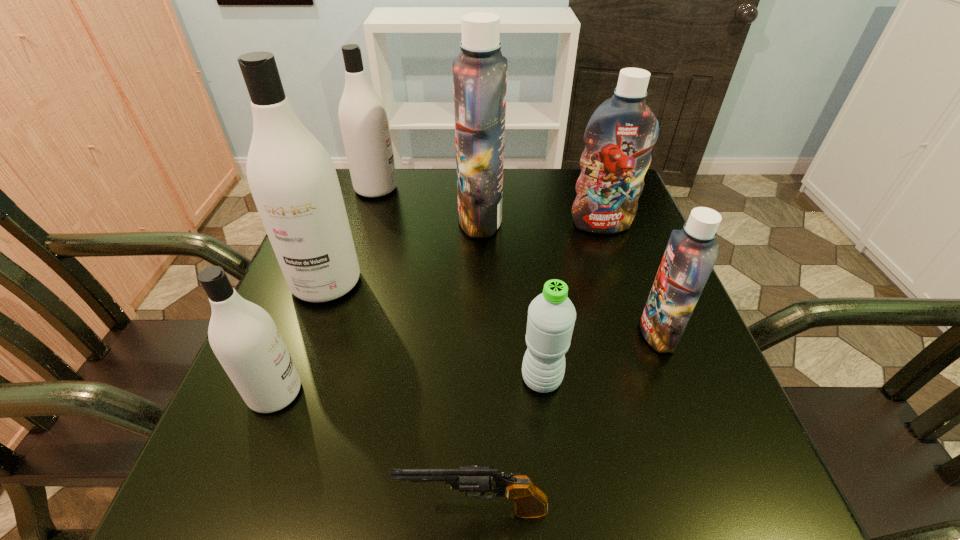
Select which shampoo appears as the fifth closest to the nearest white shampoo. Please provide its 2D coordinates. Your answer should be formatted as a tuple, i.e. [(x, y)], where the tuple contains the x and y coordinates of a point satisfying the conditions above.

[(619, 137)]

This screenshot has width=960, height=540. I want to click on blue shampoo object that ranks as the second closest to the biggest white shampoo, so click(x=619, y=137).

Locate which blue shampoo ranks third in proximity to the third nearest shampoo. Please provide its 2D coordinates. Your answer should be formatted as a tuple, i.e. [(x, y)], where the tuple contains the x and y coordinates of a point satisfying the conditions above.

[(691, 253)]

Identify which white shampoo is the second nearest to the nearest shampoo. Please provide its 2D coordinates. Your answer should be formatted as a tuple, i.e. [(x, y)], where the tuple contains the x and y coordinates of a point satisfying the conditions above.

[(363, 118)]

Identify which white shampoo is the second closest to the biggest white shampoo. Please provide its 2D coordinates. Your answer should be formatted as a tuple, i.e. [(x, y)], where the tuple contains the x and y coordinates of a point satisfying the conditions above.

[(363, 118)]

The height and width of the screenshot is (540, 960). Identify the location of vacant space that satisfies the following two spatial constraints: 1. on the front side of the seventh tallest object; 2. on the front-facing side of the nearest white shampoo. (543, 393).

The height and width of the screenshot is (540, 960). In order to click on vacant region that satisfies the following two spatial constraints: 1. on the front-facing side of the farthest white shampoo; 2. on the left side of the water bottle in this screenshot , I will do `click(315, 379)`.